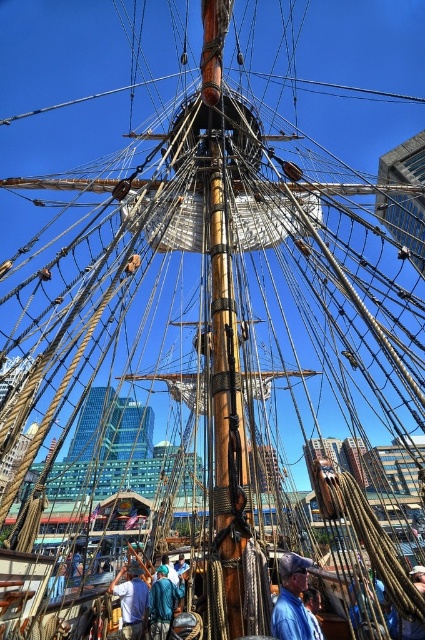
Is blue denim shirt at center bigger than blue fabric shirt at center?

Indeed, blue denim shirt at center has a larger size compared to blue fabric shirt at center.

Between blue denim shirt at center and blue fabric shirt at center, which one is positioned lower?

blue fabric shirt at center is below.

Identify the location of blue denim shirt at center. (291, 600).

The width and height of the screenshot is (425, 640). What do you see at coordinates (132, 600) in the screenshot?
I see `white cotton shirt at center` at bounding box center [132, 600].

Which of these two, white cotton shirt at center or blue fabric shirt at center, stands taller?

Standing taller between the two is white cotton shirt at center.

Which is behind, point (121, 627) or point (161, 579)?

Positioned behind is point (161, 579).

Image resolution: width=425 pixels, height=640 pixels. In order to click on white cotton shirt at center in this screenshot , I will do `click(132, 600)`.

Is blue denim shirt at center taller than white cotton shirt at center?

No, blue denim shirt at center is not taller than white cotton shirt at center.

Who is higher up, blue denim shirt at center or white cotton shirt at center?

blue denim shirt at center is higher up.

The image size is (425, 640). I want to click on blue denim shirt at center, so click(291, 600).